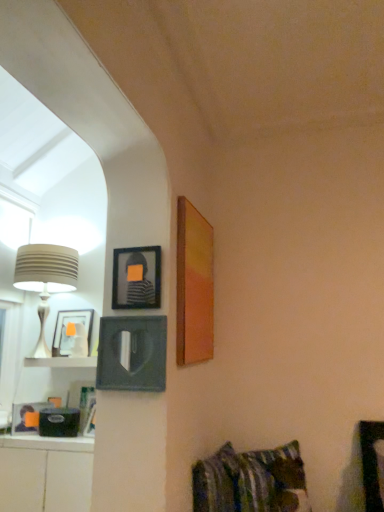
Question: Looking at the image, does matte black picture frame at left, which is the 1th picture frame from left to right, seem bigger or smaller compared to striped fabric pillow at lower right?

Choices:
 (A) small
 (B) big

Answer: (A)

Question: From the image's perspective, is matte black picture frame at left, which appears as the third picture frame when viewed from the right, positioned above or below striped fabric pillow at lower right?

Choices:
 (A) above
 (B) below

Answer: (A)

Question: Which object is positioned closest to the striped fabric pillow at lower right?

Choices:
 (A) matte wooden picture frame at upper right, which is counted as the 3th picture frame, starting from the left
 (B) beige ribbed lampshade at left
 (C) matte black picture frame at upper center, the 2th picture frame positioned from the left
 (D) matte black picture frame at left, which appears as the third picture frame when viewed from the right
 (E) white glossy cabinet at lower left

Answer: (E)

Question: Which object is the closest to the striped fabric pillow at lower right?

Choices:
 (A) matte wooden picture frame at upper right, which ranks as the 1th picture frame in right-to-left order
 (B) striped fabric pillow at lower right
 (C) beige ribbed lampshade at left
 (D) matte black picture frame at left, which appears as the third picture frame when viewed from the right
 (E) matte black picture frame at upper center, the 2th picture frame positioned from the left

Answer: (B)